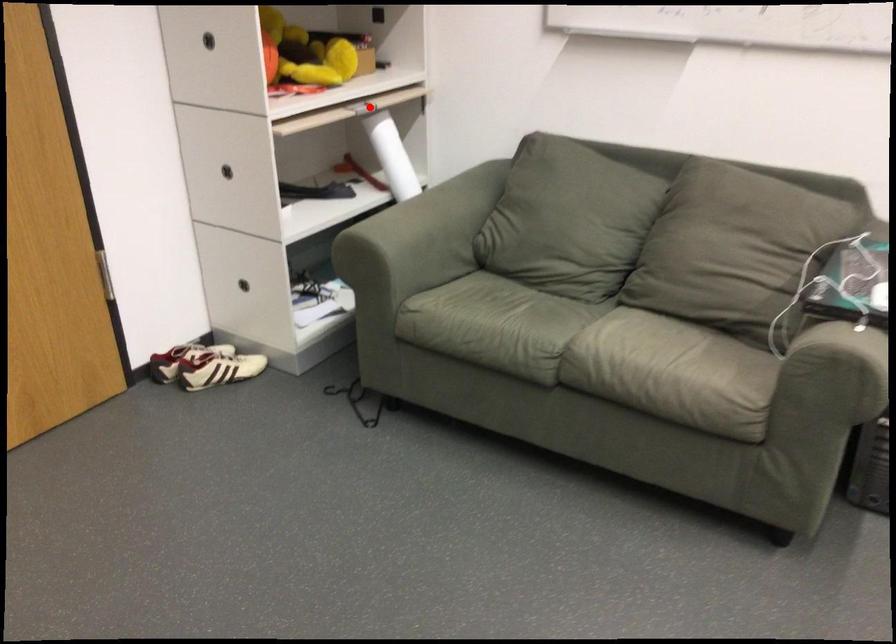
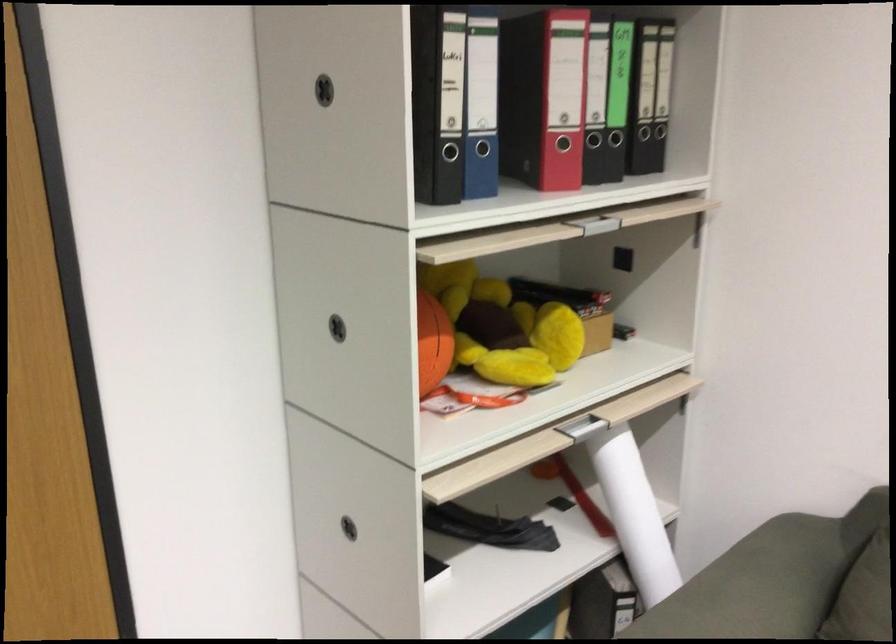
Question: I am providing you with two images of the same scene from different viewpoints. Given a red point in image1, look at the same physical point in image2. Is it:

Choices:
 (A) Closer to the viewpoint
 (B) Farther from the viewpoint

Answer: (A)